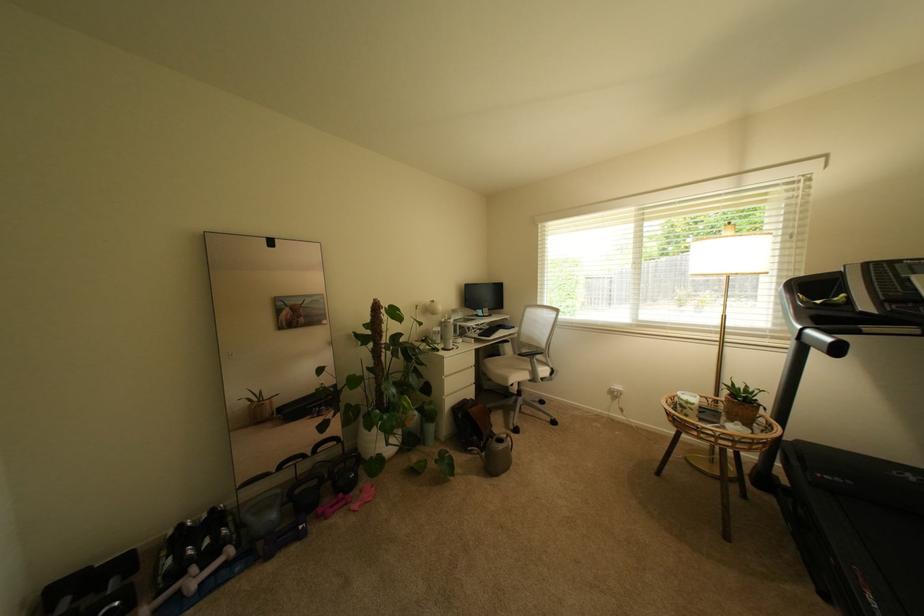
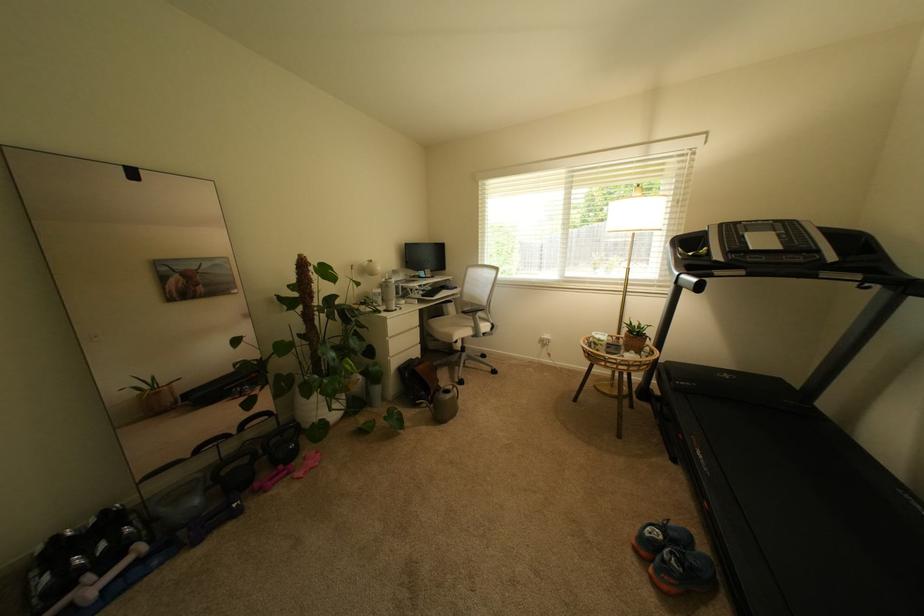
The point at (x=813, y=339) is marked in the first image. Where is the corresponding point in the second image?

(688, 283)